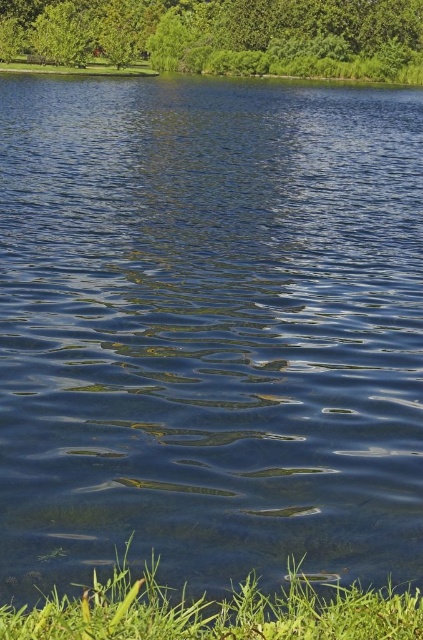
You are standing at the edge of the water and want to walk to the green leafy tree at upper center. Which direction should you head relative to the green grass at lower left?

The green leafy tree at upper center is positioned on the left side of green grass at lower left, so you should head to the left relative to the green grass at lower left to reach the tree.

You are standing at the edge of the water and want to see the top of the green leafy tree at upper center. Since you can already see the green grass at lower left, which object is taller?

The green leafy tree at upper center is much taller than the green grass at lower left, so the tree is taller.

You are standing at the edge of the lake and see two points in the water. The first point is located at coordinates point(357, 54) and the second at point(117, 628). Which point is closer to you?

Point(357, 54) is further to the camera than point(117, 628), so the point closer to you is point(117, 628).